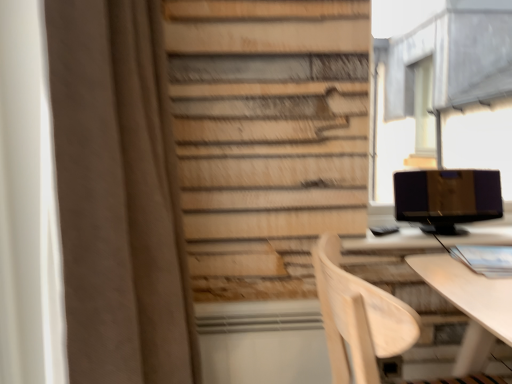
Question: Does matte black monitor at right have a lesser height compared to metallic gray bay window at upper right?

Choices:
 (A) no
 (B) yes

Answer: (B)

Question: Considering the relative positions of matte black monitor at right and metallic gray bay window at upper right in the image provided, is matte black monitor at right in front of metallic gray bay window at upper right?

Choices:
 (A) yes
 (B) no

Answer: (A)

Question: From the image's perspective, would you say matte black monitor at right is shown under metallic gray bay window at upper right?

Choices:
 (A) no
 (B) yes

Answer: (B)

Question: Does matte black monitor at right have a lesser width compared to metallic gray bay window at upper right?

Choices:
 (A) no
 (B) yes

Answer: (A)

Question: Would you say matte black monitor at right contains metallic gray bay window at upper right?

Choices:
 (A) no
 (B) yes

Answer: (A)

Question: Can you confirm if matte black monitor at right is positioned to the left of metallic gray bay window at upper right?

Choices:
 (A) yes
 (B) no

Answer: (A)

Question: From a real-world perspective, is light wood chair at lower right positioned over brown fabric curtain at left based on gravity?

Choices:
 (A) no
 (B) yes

Answer: (A)

Question: Can you confirm if light wood chair at lower right is positioned to the left of brown fabric curtain at left?

Choices:
 (A) no
 (B) yes

Answer: (A)

Question: From a real-world perspective, does light wood chair at lower right sit lower than brown fabric curtain at left?

Choices:
 (A) yes
 (B) no

Answer: (A)

Question: Is light wood chair at lower right positioned before brown fabric curtain at left?

Choices:
 (A) yes
 (B) no

Answer: (B)

Question: Considering the relative sizes of light wood chair at lower right and brown fabric curtain at left in the image provided, is light wood chair at lower right bigger than brown fabric curtain at left?

Choices:
 (A) yes
 (B) no

Answer: (B)

Question: Can you confirm if light wood chair at lower right is taller than brown fabric curtain at left?

Choices:
 (A) no
 (B) yes

Answer: (A)

Question: From a real-world perspective, is metallic gray bay window at upper right beneath matte black monitor at right?

Choices:
 (A) yes
 (B) no

Answer: (B)